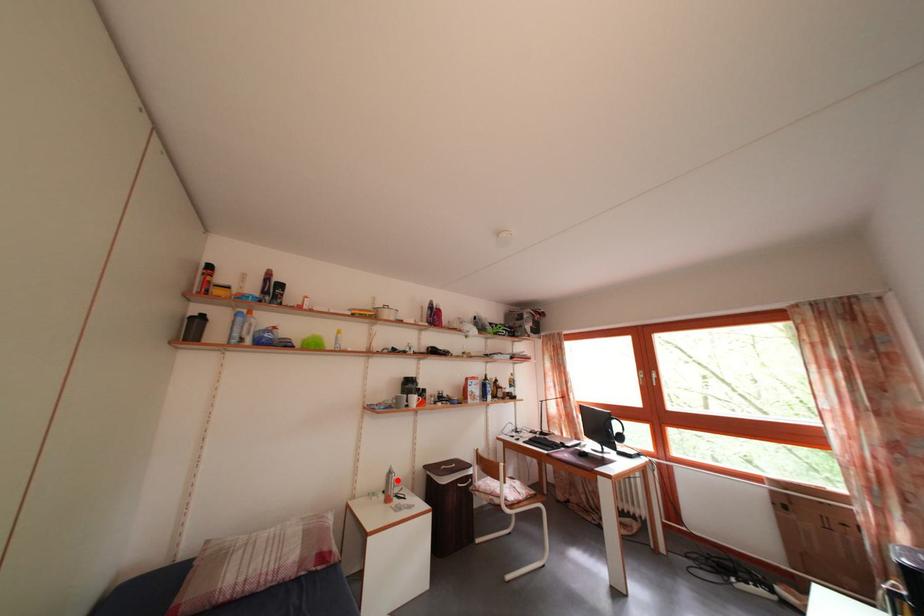
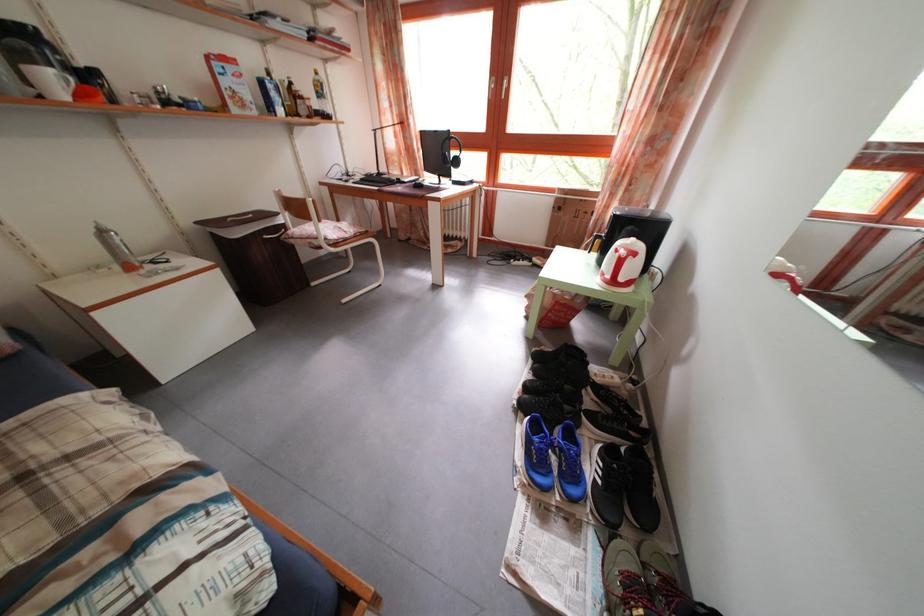
Question: I am providing you with two images of the same scene from different viewpoints. A red point is marked on the first image. Is the red point's position out of view in image 2?

Choices:
 (A) Yes
 (B) No

Answer: (B)